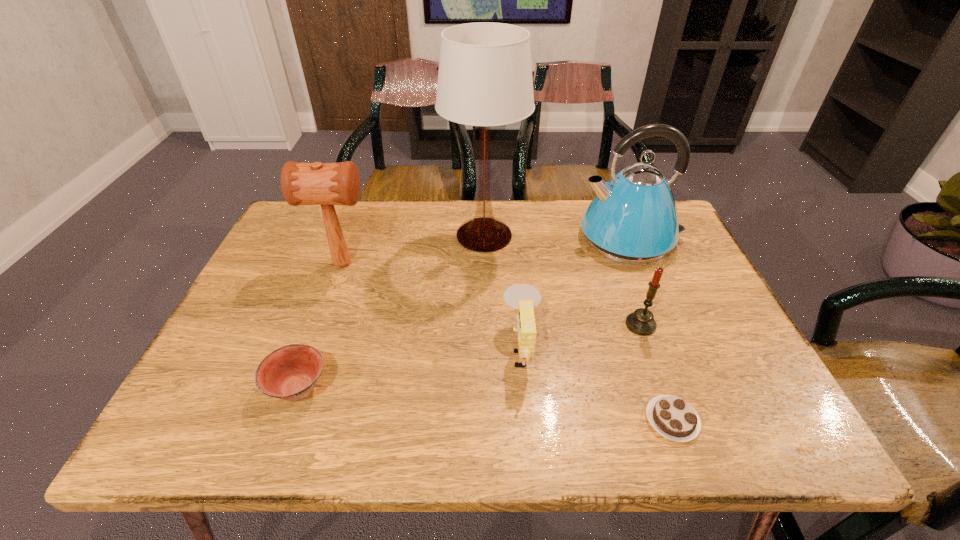
You are a GUI agent. You are given a task and a screenshot of the screen. Output one action in this format:
    pyautogui.click(x=<x>, y=<y>)
    Task: Click on the vacant space located 0.160m at the spout of the kettle
    The height and width of the screenshot is (540, 960).
    Given the screenshot: What is the action you would take?
    pyautogui.click(x=522, y=238)

Find the location of `free space located 0.100m at the spout of the kettle`. free space located 0.100m at the spout of the kettle is located at coordinates (542, 238).

Where is `free region located at the spout of the kettle`? free region located at the spout of the kettle is located at coordinates (487, 238).

Identify the location of vacant region located on the strike surface of the mallet. The width and height of the screenshot is (960, 540). (479, 264).

Find the location of a particular element. Image resolution: width=960 pixels, height=540 pixels. free region located 0.180m on the right of the fourth tallest object is located at coordinates (732, 325).

Locate an element on the screen. free space located 0.090m on the front-facing side of the fifth tallest object is located at coordinates 463,348.

This screenshot has width=960, height=540. I want to click on vacant space situated on the front-facing side of the fifth tallest object, so click(335, 348).

Where is `free space located on the front-facing side of the fifth tallest object`? This screenshot has width=960, height=540. free space located on the front-facing side of the fifth tallest object is located at coordinates (458, 348).

Find the location of a particular element. This screenshot has height=540, width=960. vacant space positioned on the back of the bowl is located at coordinates (347, 254).

What are the coordinates of `vacant area located on the left of the shortest object` in the screenshot? It's located at (531, 420).